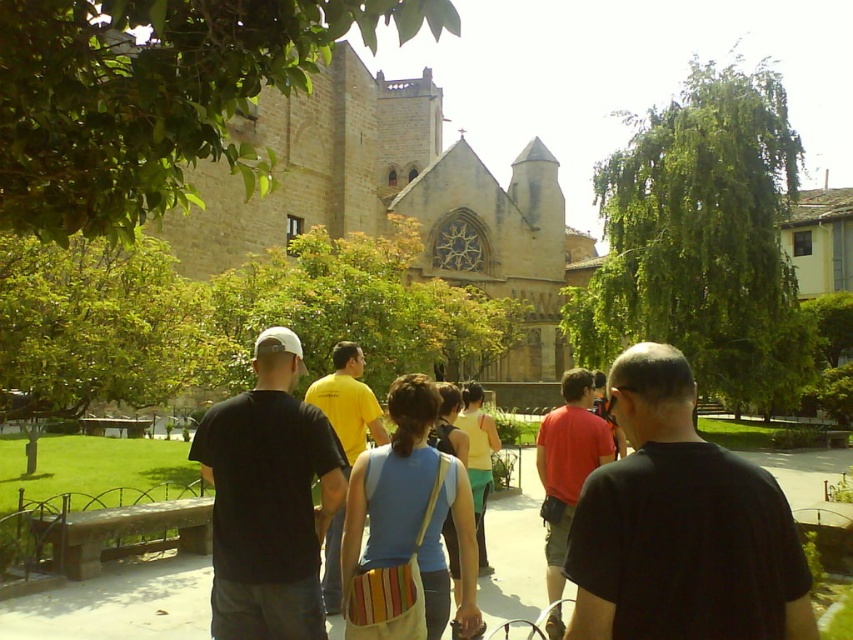
Who is higher up, black matte t-shirt at center or red cotton shirt at center?

black matte t-shirt at center is above.

Between point (247, 419) and point (548, 502), which one is positioned behind?

Positioned behind is point (548, 502).

Locate an element on the screen. black matte t-shirt at center is located at coordinates (268, 499).

Find the location of a particular element. Image resolution: width=853 pixels, height=640 pixels. black matte t-shirt at center is located at coordinates [268, 499].

Which is behind, point (308, 108) or point (347, 497)?

Positioned behind is point (308, 108).

This screenshot has width=853, height=640. I want to click on brown stone church at center, so click(397, 200).

I want to click on brown stone church at center, so click(397, 200).

Which of these two, black matte shirt at center or yellow cotton shirt at center, stands taller?

Standing taller between the two is yellow cotton shirt at center.

Find the location of a particular element. The image size is (853, 640). black matte shirt at center is located at coordinates (682, 525).

The height and width of the screenshot is (640, 853). I want to click on black matte shirt at center, so click(682, 525).